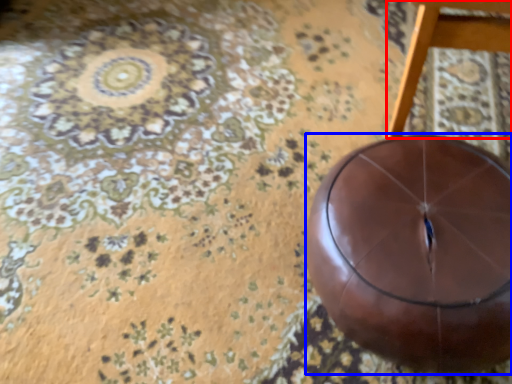
Question: Which of the following is the closest to the observer, furniture (highlighted by a red box) or ball (highlighted by a blue box)?

Choices:
 (A) furniture
 (B) ball

Answer: (A)